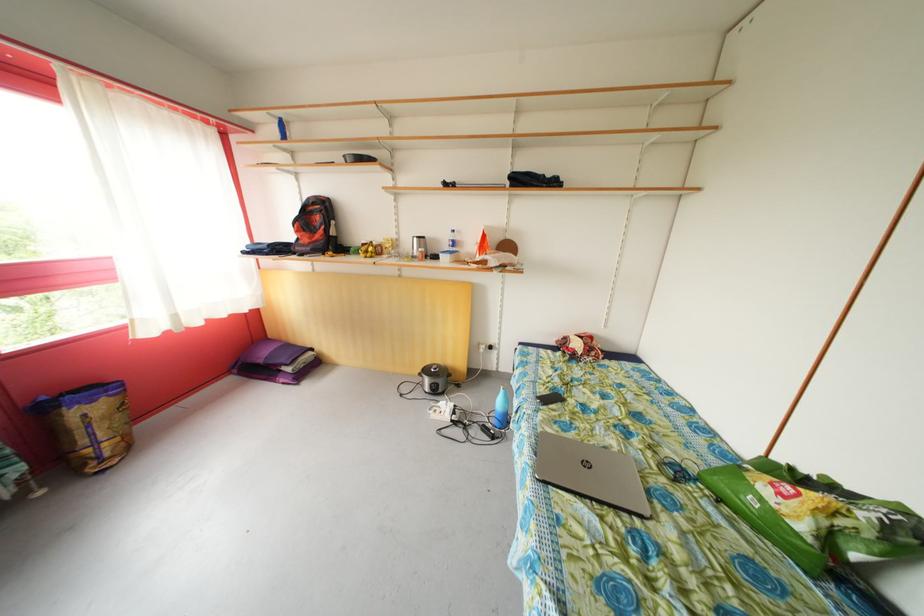
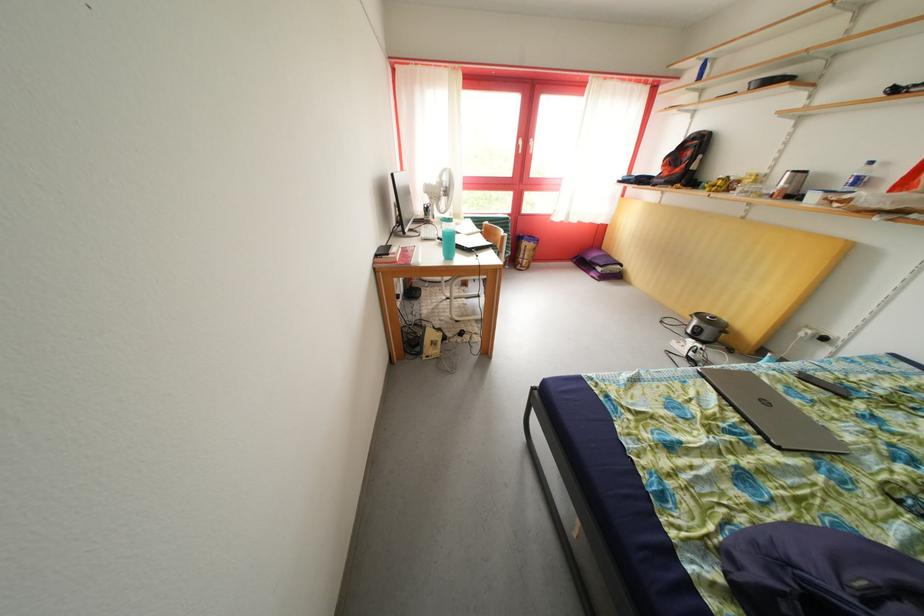
Find the pixel in the second image that matches [443,397] in the first image.

(702, 342)